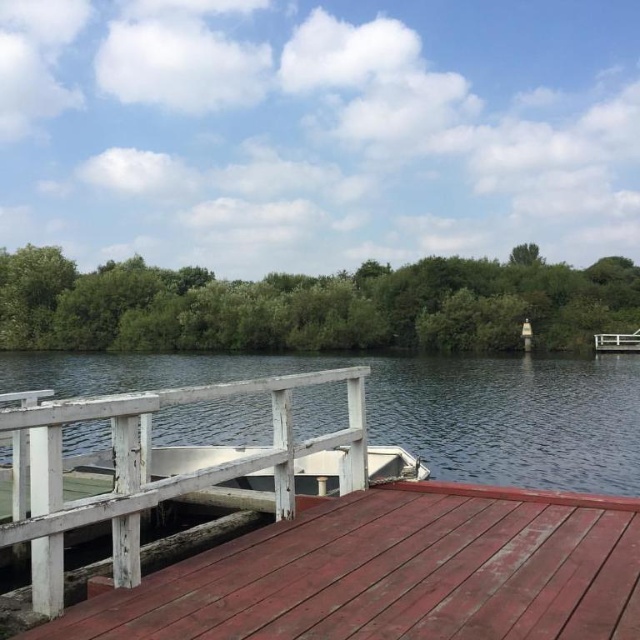
Question: Estimate the real-world distances between objects in this image. Which object is closer to the clear water at dock center?

Choices:
 (A) rustic wood deck at center
 (B) white weathered wood rail at center

Answer: (A)

Question: Which object is positioned farthest from the white weathered wood rail at center?

Choices:
 (A) rustic wood deck at center
 (B) clear water at dock center

Answer: (B)

Question: Is the position of clear water at dock center more distant than that of white weathered wood rail at center?

Choices:
 (A) no
 (B) yes

Answer: (B)

Question: Does rustic wood deck at center have a lesser width compared to white weathered wood rail at center?

Choices:
 (A) no
 (B) yes

Answer: (A)

Question: Does rustic wood deck at center have a smaller size compared to white weathered wood rail at center?

Choices:
 (A) yes
 (B) no

Answer: (A)

Question: Which object appears farthest from the camera in this image?

Choices:
 (A) rustic wood deck at center
 (B) white weathered wood rail at center

Answer: (B)